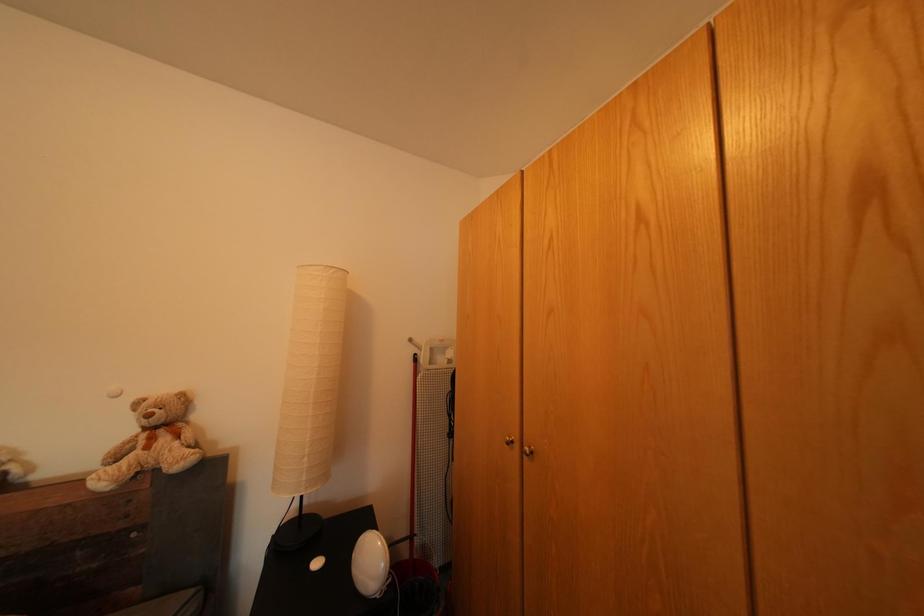
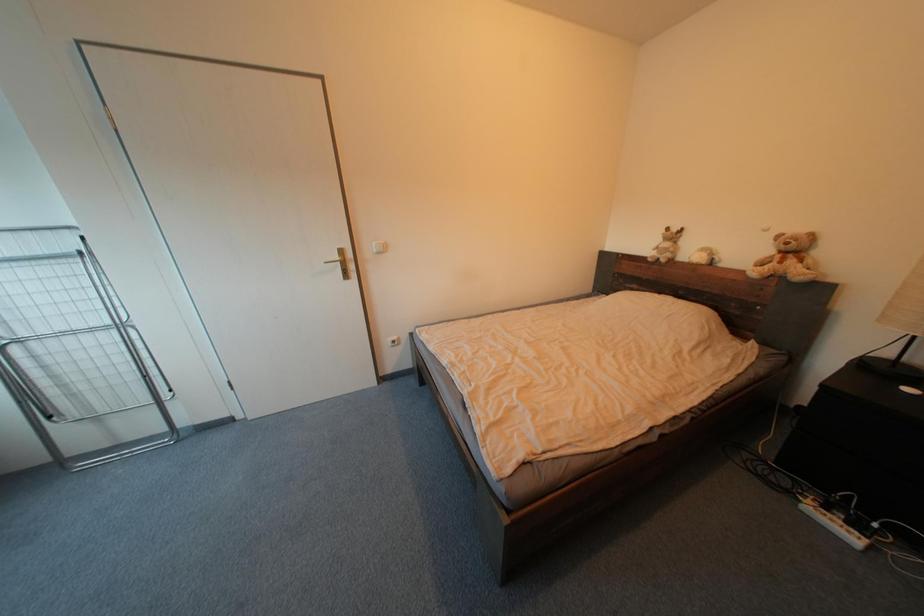
How did the camera likely rotate?

The camera rotated toward left-down.